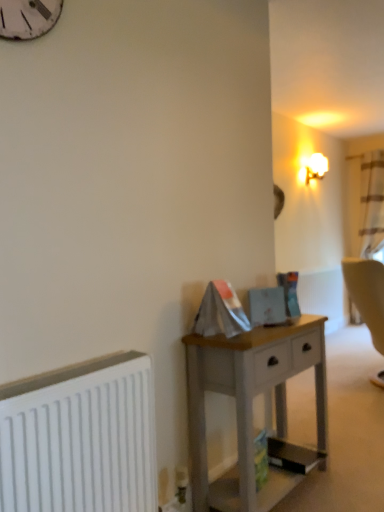
Question: Could you tell me if white painted wood desk at center is facing white frosted glass lampshade at upper right?

Choices:
 (A) yes
 (B) no

Answer: (B)

Question: From the image's perspective, is white painted wood desk at center over white frosted glass lampshade at upper right?

Choices:
 (A) no
 (B) yes

Answer: (A)

Question: Is white frosted glass lampshade at upper right at the back of white painted wood desk at center?

Choices:
 (A) no
 (B) yes

Answer: (A)

Question: Considering the relative sizes of white painted wood desk at center and white frosted glass lampshade at upper right in the image provided, is white painted wood desk at center wider than white frosted glass lampshade at upper right?

Choices:
 (A) no
 (B) yes

Answer: (B)

Question: Does white painted wood desk at center appear on the left side of white frosted glass lampshade at upper right?

Choices:
 (A) no
 (B) yes

Answer: (B)

Question: From the image's perspective, is white frosted glass lampshade at upper right above or below white painted wood desk at center?

Choices:
 (A) above
 (B) below

Answer: (A)

Question: From a real-world perspective, is white frosted glass lampshade at upper right positioned above or below white painted wood desk at center?

Choices:
 (A) below
 (B) above

Answer: (B)

Question: Would you say white frosted glass lampshade at upper right is inside or outside white painted wood desk at center?

Choices:
 (A) outside
 (B) inside

Answer: (A)

Question: Considering the positions of point (319, 159) and point (269, 331), is point (319, 159) closer or farther from the camera than point (269, 331)?

Choices:
 (A) farther
 (B) closer

Answer: (A)

Question: From a real-world perspective, is white painted wood desk at center positioned above or below white frosted glass lampshade at upper right?

Choices:
 (A) above
 (B) below

Answer: (B)

Question: Considering the positions of white painted wood desk at center and white frosted glass lampshade at upper right in the image, is white painted wood desk at center bigger or smaller than white frosted glass lampshade at upper right?

Choices:
 (A) small
 (B) big

Answer: (B)

Question: In the image, is white painted wood desk at center positioned in front of or behind white frosted glass lampshade at upper right?

Choices:
 (A) front
 (B) behind

Answer: (A)

Question: From the image's perspective, relative to white frosted glass lampshade at upper right, is white painted wood desk at center above or below?

Choices:
 (A) below
 (B) above

Answer: (A)

Question: Based on their sizes in the image, would you say white matte radiator at lower left is bigger or smaller than white frosted glass lampshade at upper right?

Choices:
 (A) big
 (B) small

Answer: (A)

Question: Is white matte radiator at lower left to the left or to the right of white frosted glass lampshade at upper right in the image?

Choices:
 (A) left
 (B) right

Answer: (A)